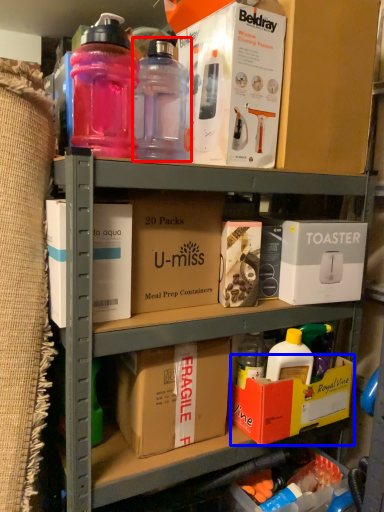
Question: Which point is closer to the camera, bottle (highlighted by a red box) or box (highlighted by a blue box)?

Choices:
 (A) bottle
 (B) box

Answer: (A)